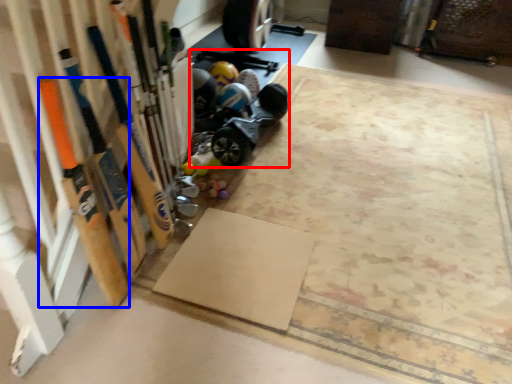
Question: Which object is further to the camera taking this photo, car (highlighted by a red box) or baseball bat (highlighted by a blue box)?

Choices:
 (A) car
 (B) baseball bat

Answer: (A)